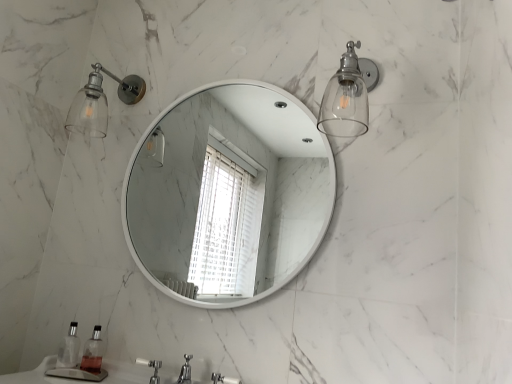
Question: Is clear glass sconce at upper right wider than white plastic faucet at lower center?

Choices:
 (A) no
 (B) yes

Answer: (B)

Question: Considering the relative sizes of clear glass sconce at upper right and white plastic faucet at lower center in the image provided, is clear glass sconce at upper right smaller than white plastic faucet at lower center?

Choices:
 (A) no
 (B) yes

Answer: (A)

Question: Considering the relative positions of clear glass sconce at upper right and white plastic faucet at lower center in the image provided, is clear glass sconce at upper right to the left of white plastic faucet at lower center from the viewer's perspective?

Choices:
 (A) yes
 (B) no

Answer: (B)

Question: Is white plastic faucet at lower center surrounded by clear glass sconce at upper right?

Choices:
 (A) no
 (B) yes

Answer: (A)

Question: Is clear glass sconce at upper right behind white plastic faucet at lower center?

Choices:
 (A) yes
 (B) no

Answer: (B)

Question: From a real-world perspective, is clear glass sconce at upper right located beneath white plastic faucet at lower center?

Choices:
 (A) no
 (B) yes

Answer: (A)

Question: Could you tell me if clear glass sconce at upper left is facing clear glass soap dispenser at lower left, positioned as the second soap dispenser in left-to-right order?

Choices:
 (A) no
 (B) yes

Answer: (A)

Question: Does clear glass sconce at upper left appear on the right side of clear glass soap dispenser at lower left, positioned as the second soap dispenser in left-to-right order?

Choices:
 (A) no
 (B) yes

Answer: (A)

Question: Is clear glass sconce at upper left further to camera compared to clear glass soap dispenser at lower left, positioned as the second soap dispenser in left-to-right order?

Choices:
 (A) yes
 (B) no

Answer: (A)

Question: Is clear glass sconce at upper left looking in the opposite direction of clear glass soap dispenser at lower left, positioned as the second soap dispenser in left-to-right order?

Choices:
 (A) yes
 (B) no

Answer: (B)

Question: From a real-world perspective, does clear glass sconce at upper left stand above clear glass soap dispenser at lower left, positioned as the second soap dispenser in left-to-right order?

Choices:
 (A) yes
 (B) no

Answer: (A)

Question: Does clear glass sconce at upper left have a greater width compared to clear glass soap dispenser at lower left, the 1th soap dispenser from the right?

Choices:
 (A) yes
 (B) no

Answer: (A)

Question: From the image's perspective, does white glossy mirror at center appear lower than white plastic faucet at lower center?

Choices:
 (A) no
 (B) yes

Answer: (A)